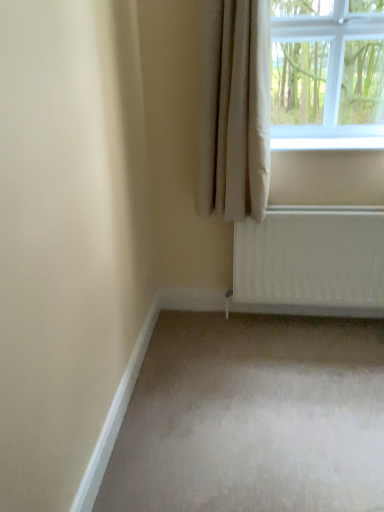
Question: From a real-world perspective, relative to white glass window at upper right, is beige fabric curtain at upper right vertically above or below?

Choices:
 (A) above
 (B) below

Answer: (B)

Question: Considering the positions of point (253, 3) and point (311, 138), is point (253, 3) closer or farther from the camera than point (311, 138)?

Choices:
 (A) closer
 (B) farther

Answer: (A)

Question: Estimate the real-world distances between objects in this image. Which object is farther from the beige fabric curtain at upper right?

Choices:
 (A) white glass window at upper right
 (B) white plastic window sill at upper right

Answer: (A)

Question: Which object is the closest to the white glass window at upper right?

Choices:
 (A) beige fabric curtain at upper right
 (B) white plastic window sill at upper right

Answer: (B)